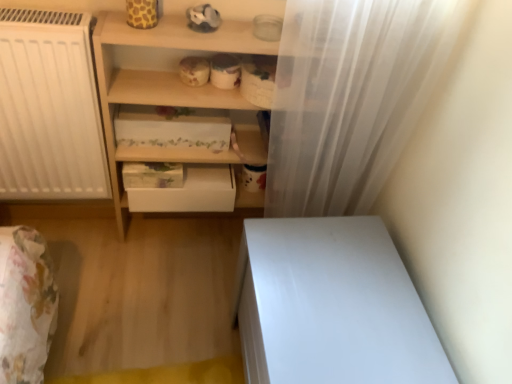
Question: Does white floral-patterned drawer at center, the second shelf from the bottom, have a smaller size compared to white matte drawer at center?

Choices:
 (A) yes
 (B) no

Answer: (B)

Question: Is white floral-patterned drawer at center, the second shelf from the bottom, taller than white matte drawer at center?

Choices:
 (A) no
 (B) yes

Answer: (A)

Question: Does white floral-patterned drawer at center, the second shelf from the bottom, come in front of white matte drawer at center?

Choices:
 (A) no
 (B) yes

Answer: (B)

Question: From the image's perspective, is white floral-patterned drawer at center, positioned as the first shelf in top-to-bottom order, over white matte drawer at center?

Choices:
 (A) yes
 (B) no

Answer: (A)

Question: Is white floral-patterned drawer at center, the second shelf from the bottom, facing towards white matte drawer at center?

Choices:
 (A) no
 (B) yes

Answer: (A)

Question: Looking at their shapes, would you say white sheer curtain at right is wider or thinner than white floral-patterned drawer at center, positioned as the first shelf in top-to-bottom order?

Choices:
 (A) wide
 (B) thin

Answer: (B)

Question: From a real-world perspective, is white sheer curtain at right positioned above or below white floral-patterned drawer at center, positioned as the first shelf in top-to-bottom order?

Choices:
 (A) above
 (B) below

Answer: (A)

Question: From the image's perspective, relative to white floral-patterned drawer at center, the second shelf from the bottom, is white sheer curtain at right above or below?

Choices:
 (A) below
 (B) above

Answer: (A)

Question: Considering their positions, is white sheer curtain at right located in front of or behind white floral-patterned drawer at center, the second shelf from the bottom?

Choices:
 (A) front
 (B) behind

Answer: (A)

Question: Considering the positions of white glossy vanity at lower right and white sheer curtain at right in the image, is white glossy vanity at lower right wider or thinner than white sheer curtain at right?

Choices:
 (A) thin
 (B) wide

Answer: (B)

Question: Considering the positions of white glossy vanity at lower right and white sheer curtain at right in the image, is white glossy vanity at lower right taller or shorter than white sheer curtain at right?

Choices:
 (A) tall
 (B) short

Answer: (B)

Question: From a real-world perspective, relative to white sheer curtain at right, is white glossy vanity at lower right vertically above or below?

Choices:
 (A) above
 (B) below

Answer: (B)

Question: From the image's perspective, relative to white sheer curtain at right, is white glossy vanity at lower right above or below?

Choices:
 (A) above
 (B) below

Answer: (B)

Question: From the image's perspective, is white matte drawer at center positioned above or below white glossy vanity at lower right?

Choices:
 (A) below
 (B) above

Answer: (B)

Question: From a real-world perspective, is white matte drawer at center positioned above or below white glossy vanity at lower right?

Choices:
 (A) below
 (B) above

Answer: (B)